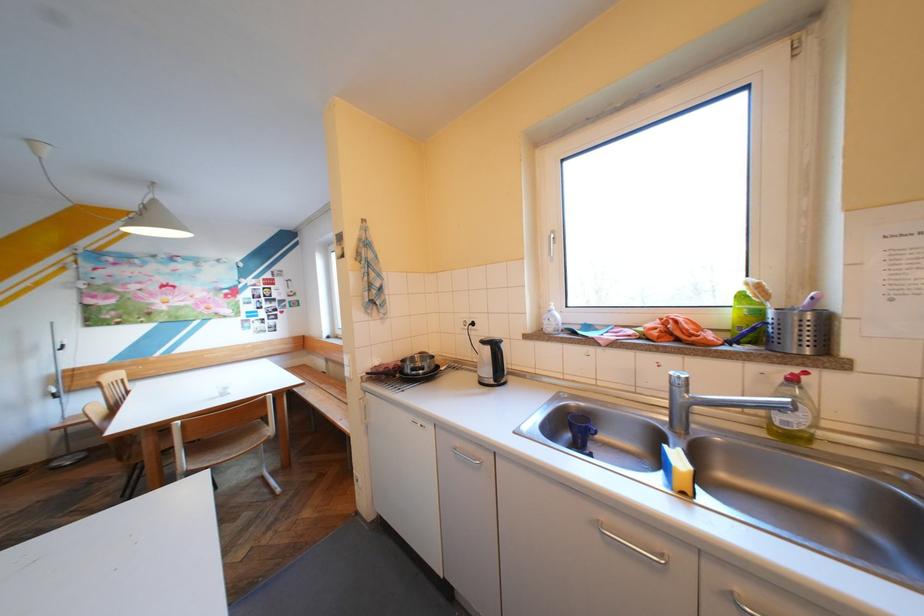
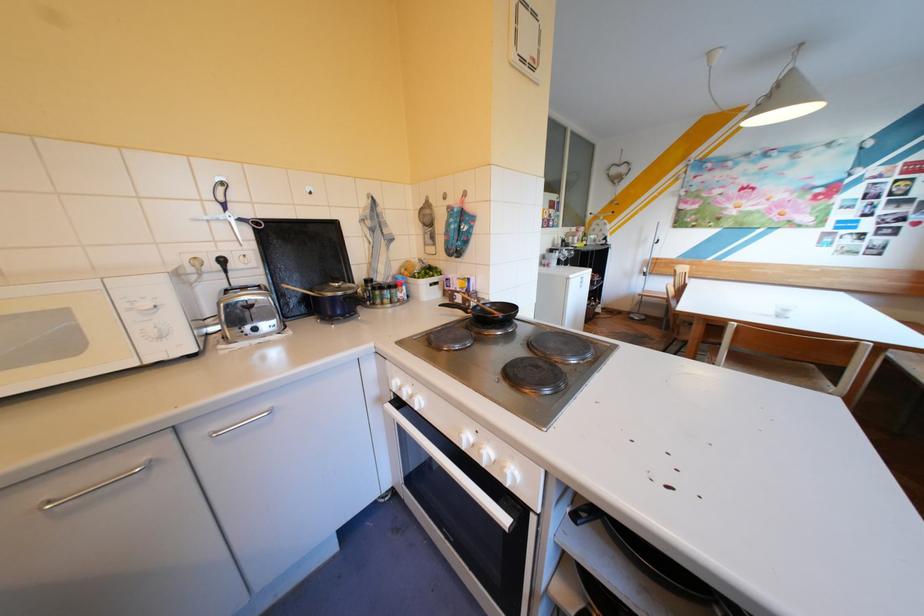
The first image is from the beginning of the video and the second image is from the end. How did the camera likely rotate when shooting the video?

The rotation direction of the camera is left-down.